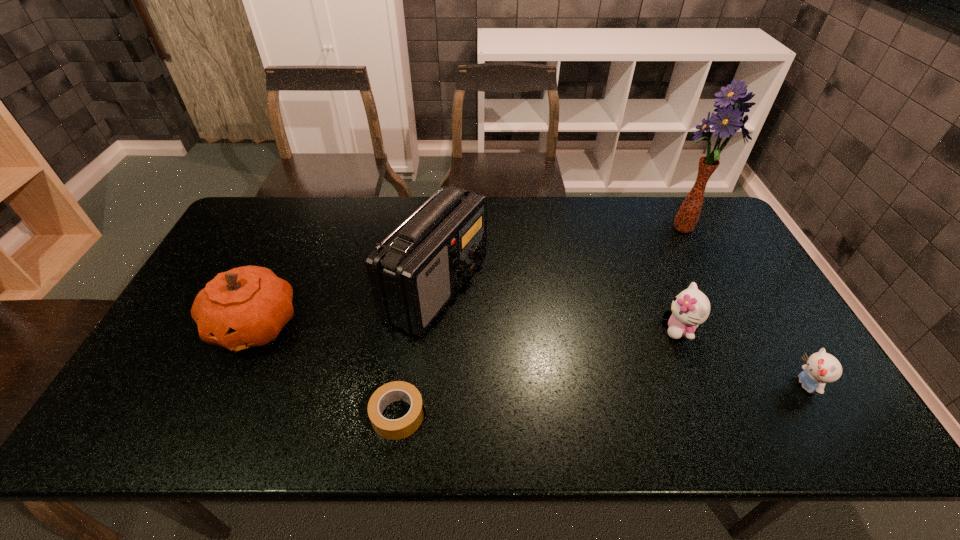
Where is `free point that satisfies the following two spatial constraints: 1. on the front side of the tallest object; 2. on the front panel of the second tallest object`? This screenshot has height=540, width=960. free point that satisfies the following two spatial constraints: 1. on the front side of the tallest object; 2. on the front panel of the second tallest object is located at coordinates (712, 288).